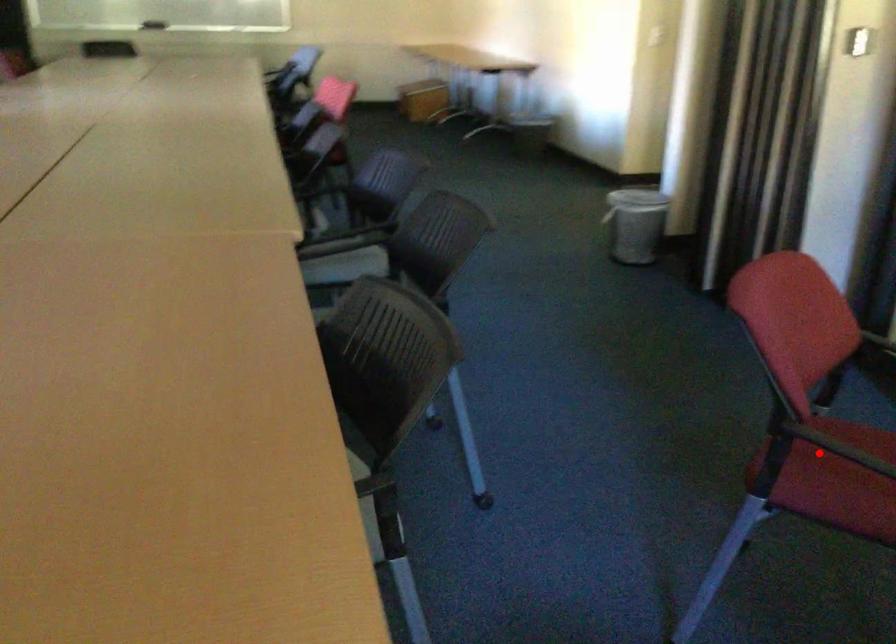
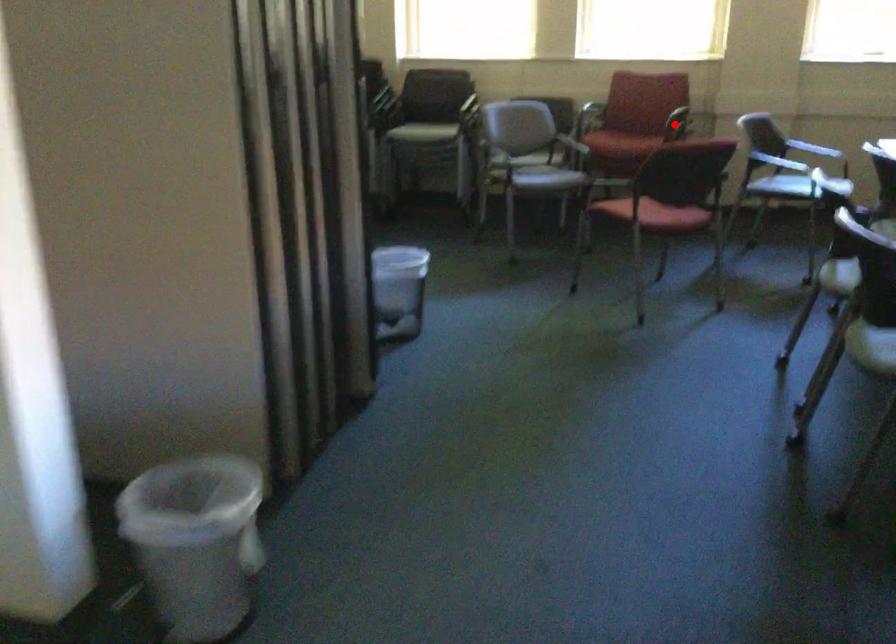
I am providing you with two images of the same scene from different viewpoints. A red point is marked on the first image and another point is marked on the second image. Do the highlighted points in image1 and image2 indicate the same real-world spot?

No